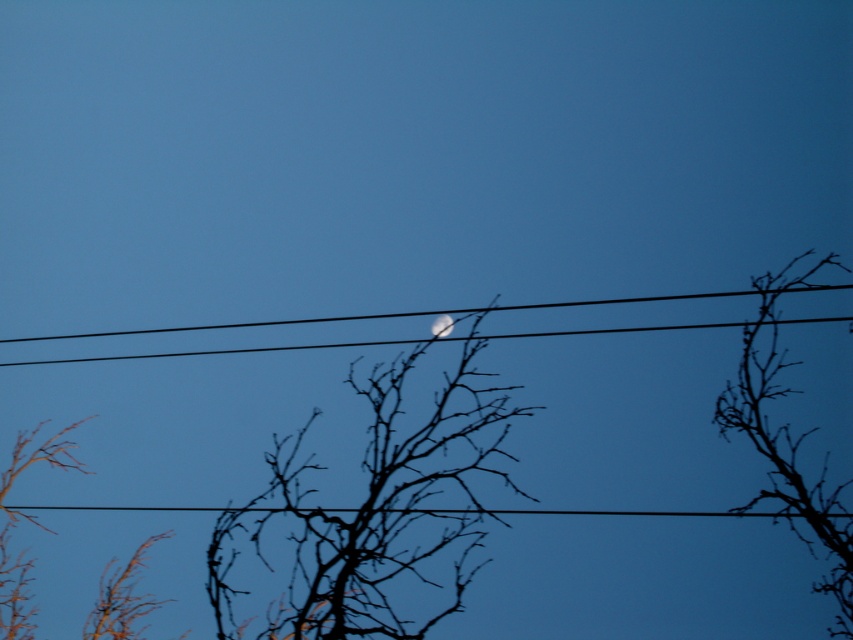
Who is taller, brown/drytree at lower left or black wire at center?

brown/drytree at lower left is taller.

Can you confirm if brown/drytree at lower left is positioned below black wire at center?

Yes, brown/drytree at lower left is below black wire at center.

Is point (85, 624) positioned in front of point (834, 289)?

No, (85, 624) is behind (834, 289).

This screenshot has height=640, width=853. I want to click on brown/drytree at lower left, so click(x=30, y=522).

Which is behind, point (477, 440) or point (316, 321)?

The point (316, 321) is behind.

Find the location of a particular element. silhouette bare branches at center is located at coordinates (372, 512).

Does brown/drytree at right have a lesser width compared to brown/drytree at lower left?

Yes.

Based on the photo, which of these two, brown/drytree at right or brown/drytree at lower left, stands taller?

brown/drytree at right

Where is `brown/drytree at right`? This screenshot has height=640, width=853. brown/drytree at right is located at coordinates (788, 445).